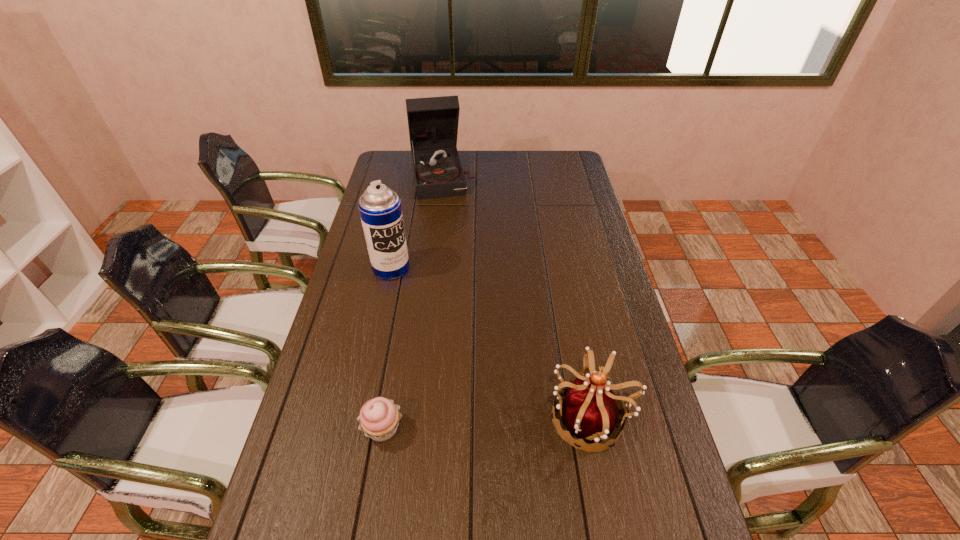
The height and width of the screenshot is (540, 960). I want to click on vacant space that satisfies the following two spatial constraints: 1. on the back side of the rightmost object; 2. on the front-facing side of the shortest object, so click(385, 417).

At what (x,y) coordinates should I click in order to perform the action: click on free space that satisfies the following two spatial constraints: 1. on the back side of the tiara; 2. on the front-facing side of the cupcake. Please return your answer as a coordinate pair (x, y). The height and width of the screenshot is (540, 960). Looking at the image, I should click on (385, 417).

Locate an element on the screen. This screenshot has width=960, height=540. vacant space that satisfies the following two spatial constraints: 1. on the front side of the phonograph_record; 2. on the front-facing side of the rightmost object is located at coordinates (416, 417).